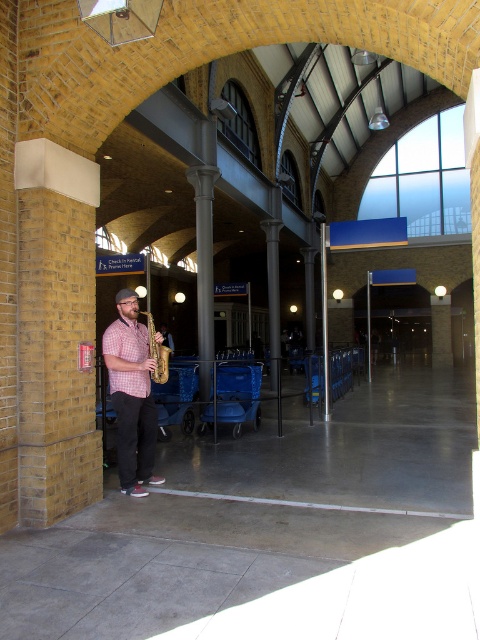
Is matte brown saxophone at center positioned at the back of shiny gold trumpet at center?

That is False.

This screenshot has width=480, height=640. Describe the element at coordinates (132, 394) in the screenshot. I see `matte brown saxophone at center` at that location.

Find the location of a particular element. matte brown saxophone at center is located at coordinates (132, 394).

The width and height of the screenshot is (480, 640). What are the coordinates of `matte brown saxophone at center` in the screenshot? It's located at (132, 394).